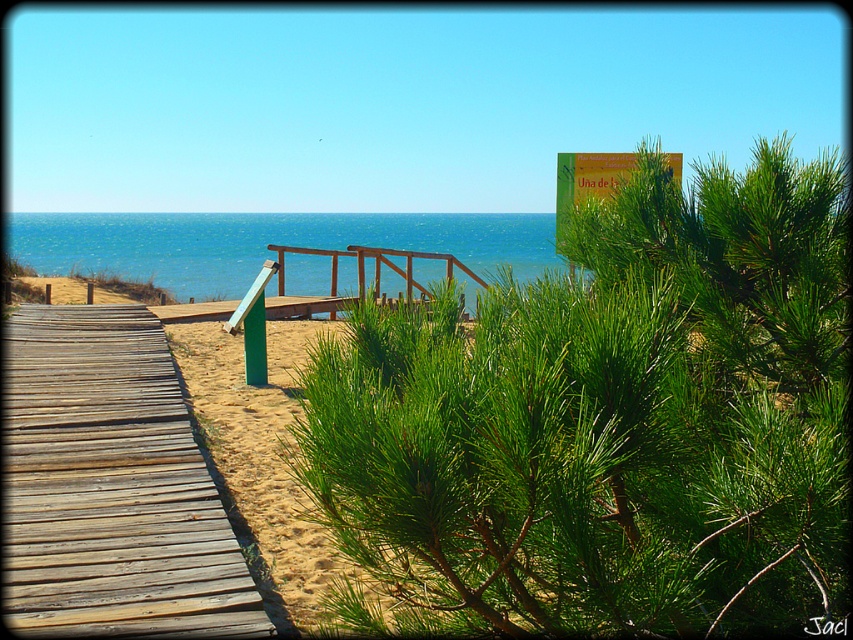
Question: Does green needle-like at center have a greater width compared to yellow paper sign at upper center?

Choices:
 (A) no
 (B) yes

Answer: (A)

Question: Can you confirm if sandy yellow at lower left is thinner than wooden rail at center?

Choices:
 (A) yes
 (B) no

Answer: (A)

Question: Which of the following is the closest to the observer?

Choices:
 (A) wooden rail at center
 (B) yellow paper sign at upper center
 (C) blue water at center
 (D) weathered wood boardwalk at lower left

Answer: (A)

Question: Which object appears farthest from the camera in this image?

Choices:
 (A) sandy yellow at lower left
 (B) wooden rail at center

Answer: (B)

Question: Can you confirm if green needle-like at center is positioned below wooden rail at center?

Choices:
 (A) yes
 (B) no

Answer: (A)

Question: Considering the real-world distances, which object is farthest from the yellow paper sign at upper center?

Choices:
 (A) sandy yellow at lower left
 (B) green needle-like at center

Answer: (A)